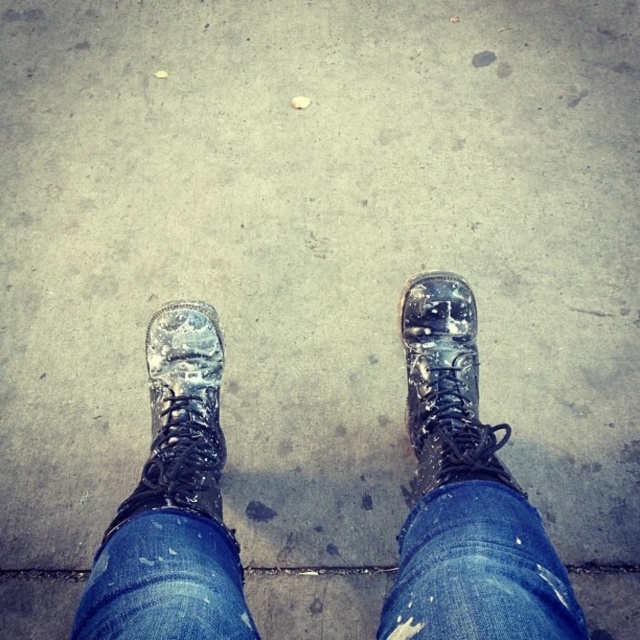
Between wet leather boots at center and wet leather boot at lower left, which one appears on the right side from the viewer's perspective?

wet leather boots at center

Is wet leather boots at center smaller than wet leather boot at lower left?

No, wet leather boots at center is not smaller than wet leather boot at lower left.

Is point (452, 324) more distant than point (173, 344)?

That is True.

Identify the location of wet leather boots at center. (465, 499).

Does blue denim jeans at center have a greater width compared to wet leather boot at lower left?

Indeed, blue denim jeans at center has a greater width compared to wet leather boot at lower left.

Can you confirm if blue denim jeans at center is bigger than wet leather boot at lower left?

No, blue denim jeans at center is not bigger than wet leather boot at lower left.

Which is in front, point (540, 625) or point (157, 317)?

Point (540, 625) is more forward.

At what (x,y) coordinates should I click in order to perform the action: click on blue denim jeans at center. Please return your answer as a coordinate pair (x, y). This screenshot has height=640, width=640. Looking at the image, I should click on (477, 572).

Is wet leather boots at center above blue denim jeans at center?

Indeed, wet leather boots at center is positioned over blue denim jeans at center.

Does wet leather boots at center come behind blue denim jeans at center?

Yes, wet leather boots at center is behind blue denim jeans at center.

Does point (465, 314) lie in front of point (483, 572)?

No, (465, 314) is further to viewer.

Find the location of a particular element. Image resolution: width=640 pixels, height=640 pixels. wet leather boots at center is located at coordinates (465, 499).